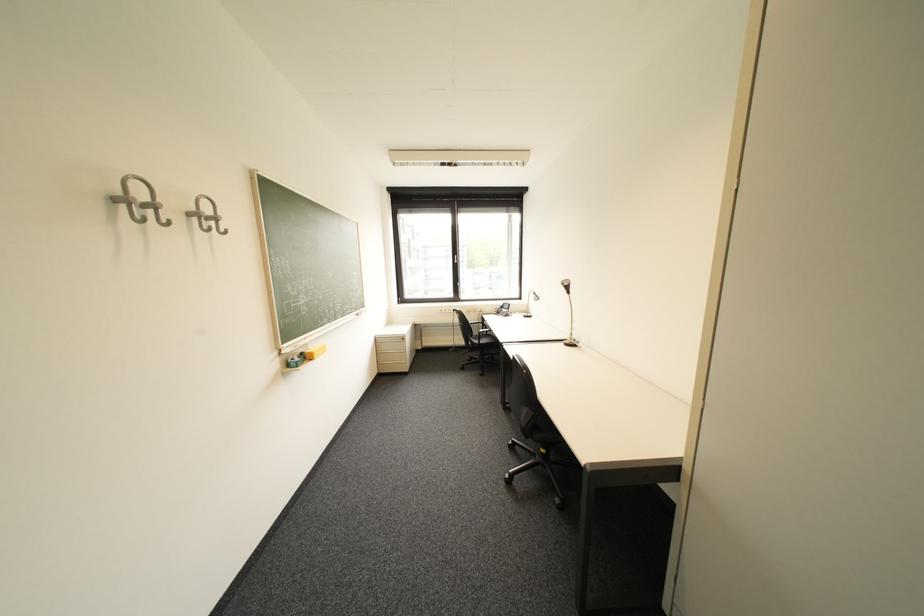
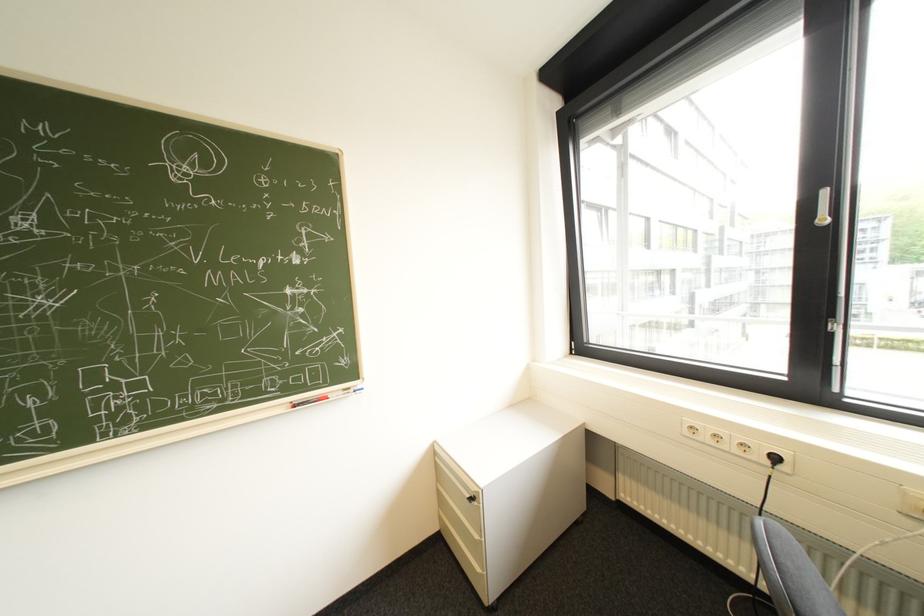
The point at (x=454, y=312) is marked in the first image. Where is the corresponding point in the second image?

(715, 438)